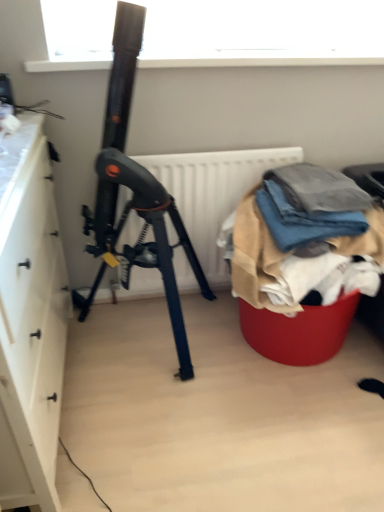
Question: Do you think textured fabric pile at lower right is within denim fabric at right, or outside of it?

Choices:
 (A) inside
 (B) outside

Answer: (B)

Question: In the image, is textured fabric pile at lower right on the left side or the right side of denim fabric at right?

Choices:
 (A) left
 (B) right

Answer: (B)

Question: Which is nearer to the white matte cabinet at left?

Choices:
 (A) white matte radiator at center
 (B) denim fabric at right
 (C) textured fabric pile at lower right

Answer: (A)

Question: Considering the real-world distances, which object is closest to the textured fabric pile at lower right?

Choices:
 (A) white matte cabinet at left
 (B) denim fabric at right
 (C) white matte radiator at center

Answer: (B)